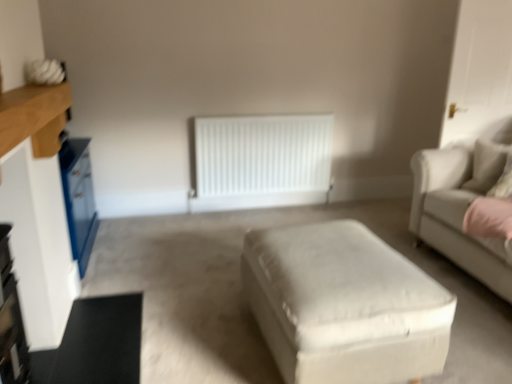
Question: From the image's perspective, is beige fabric couch at right on top of white fabric ottoman at center?

Choices:
 (A) yes
 (B) no

Answer: (A)

Question: Is beige fabric couch at right to the right of white fabric ottoman at center from the viewer's perspective?

Choices:
 (A) no
 (B) yes

Answer: (B)

Question: Is beige fabric couch at right facing towards white fabric ottoman at center?

Choices:
 (A) no
 (B) yes

Answer: (B)

Question: Is beige fabric couch at right to the left of white fabric ottoman at center from the viewer's perspective?

Choices:
 (A) no
 (B) yes

Answer: (A)

Question: Considering the relative sizes of beige fabric couch at right and white fabric ottoman at center in the image provided, is beige fabric couch at right shorter than white fabric ottoman at center?

Choices:
 (A) no
 (B) yes

Answer: (A)

Question: Is white wood entertainment center at left bigger or smaller than white fabric ottoman at center?

Choices:
 (A) big
 (B) small

Answer: (B)

Question: Considering the positions of point (23, 89) and point (339, 362), is point (23, 89) closer or farther from the camera than point (339, 362)?

Choices:
 (A) farther
 (B) closer

Answer: (B)

Question: Is white wood entertainment center at left taller or shorter than white fabric ottoman at center?

Choices:
 (A) tall
 (B) short

Answer: (B)

Question: Relative to white fabric ottoman at center, is white wood entertainment center at left in front or behind?

Choices:
 (A) behind
 (B) front

Answer: (B)

Question: Based on their sizes in the image, would you say beige fabric pillow at right is bigger or smaller than white wood entertainment center at left?

Choices:
 (A) big
 (B) small

Answer: (B)

Question: Considering the positions of point (500, 152) and point (28, 193), is point (500, 152) closer or farther from the camera than point (28, 193)?

Choices:
 (A) closer
 (B) farther

Answer: (B)

Question: In the image, is beige fabric pillow at right on the left side or the right side of white wood entertainment center at left?

Choices:
 (A) right
 (B) left

Answer: (A)

Question: In terms of width, does beige fabric pillow at right look wider or thinner when compared to white wood entertainment center at left?

Choices:
 (A) wide
 (B) thin

Answer: (A)

Question: From a real-world perspective, relative to white wood entertainment center at left, is white fabric ottoman at center vertically above or below?

Choices:
 (A) below
 (B) above

Answer: (A)

Question: Considering the positions of white fabric ottoman at center and white wood entertainment center at left in the image, is white fabric ottoman at center wider or thinner than white wood entertainment center at left?

Choices:
 (A) wide
 (B) thin

Answer: (A)